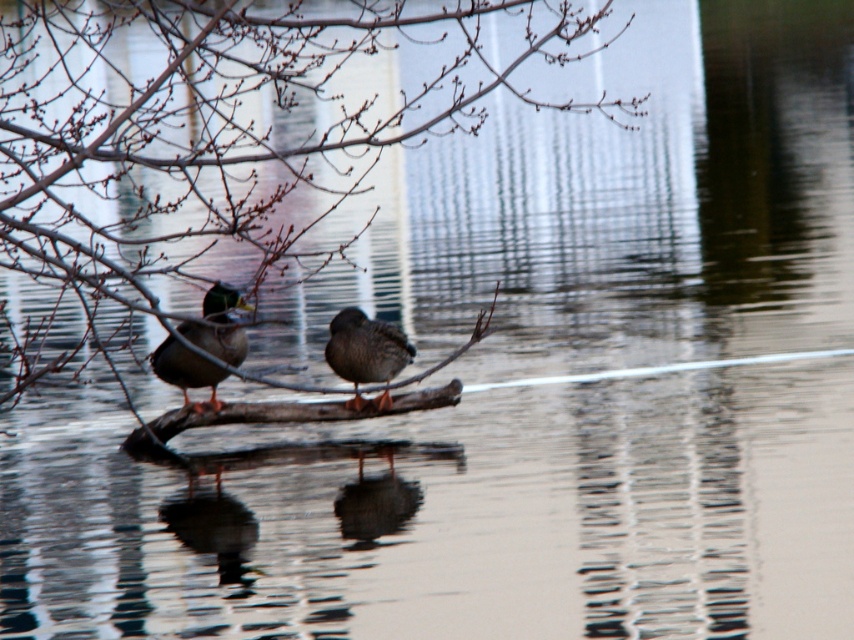
Question: Does bare branches at center appear on the left side of shiny brown duck at left?

Choices:
 (A) yes
 (B) no

Answer: (B)

Question: Which of the following is the farthest from the observer?

Choices:
 (A) (461, 19)
 (B) (180, 368)
 (C) (351, 355)

Answer: (B)

Question: Does shiny brown duck at left have a greater width compared to brown matte duck at center?

Choices:
 (A) yes
 (B) no

Answer: (A)

Question: Is shiny brown duck at left to the left of brown matte duck at center from the viewer's perspective?

Choices:
 (A) yes
 (B) no

Answer: (A)

Question: Which point is farther from the camera taking this photo?

Choices:
 (A) (211, 307)
 (B) (262, 118)
 (C) (363, 380)

Answer: (B)

Question: Which point is farther to the camera?

Choices:
 (A) bare branches at center
 (B) brown matte duck at center
 (C) shiny brown duck at left

Answer: (B)